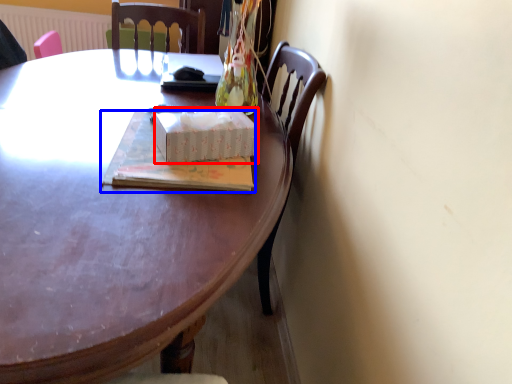
Question: Among these objects, which one is farthest to the camera, box (highlighted by a red box) or book (highlighted by a blue box)?

Choices:
 (A) box
 (B) book

Answer: (A)